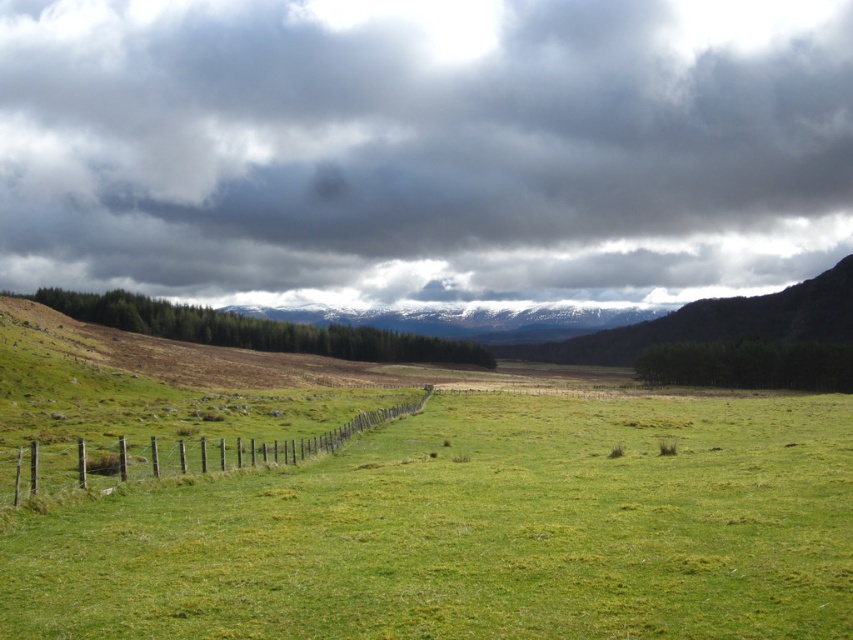
Is dark gray cloud at upper center thinner than green grass pasture at center?

In fact, dark gray cloud at upper center might be wider than green grass pasture at center.

Which of these two, dark gray cloud at upper center or green grass pasture at center, stands shorter?

green grass pasture at center is shorter.

Who is more forward, (169, 240) or (492, 422)?

Point (492, 422) is in front.

The width and height of the screenshot is (853, 640). In order to click on dark gray cloud at upper center in this screenshot , I will do [424, 148].

Does dark gray cloud at upper center have a lesser height compared to brown wooden fence at lower left?

Incorrect, dark gray cloud at upper center's height does not fall short of brown wooden fence at lower left's.

Is dark gray cloud at upper center to the left of brown wooden fence at lower left from the viewer's perspective?

Indeed, dark gray cloud at upper center is positioned on the left side of brown wooden fence at lower left.

Where is `dark gray cloud at upper center`? The width and height of the screenshot is (853, 640). dark gray cloud at upper center is located at coordinates (424, 148).

The width and height of the screenshot is (853, 640). I want to click on dark gray cloud at upper center, so click(x=424, y=148).

Is green grass pasture at center taller than brown wooden fence at lower left?

Incorrect, green grass pasture at center's height is not larger of brown wooden fence at lower left's.

Measure the distance between point (540, 579) and camera.

A distance of 20.82 meters exists between point (540, 579) and camera.

Where is `green grass pasture at center`? green grass pasture at center is located at coordinates (474, 531).